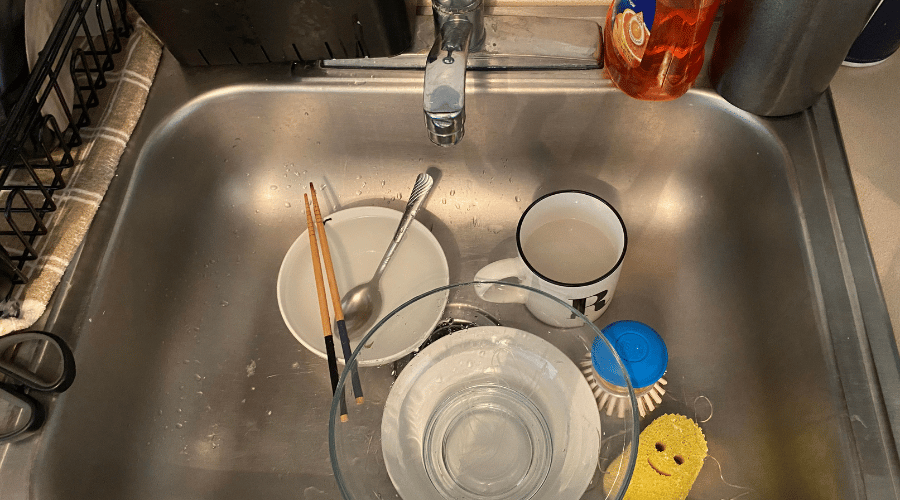
What are the coordinates of `spoon` in the screenshot? It's located at (364, 293).